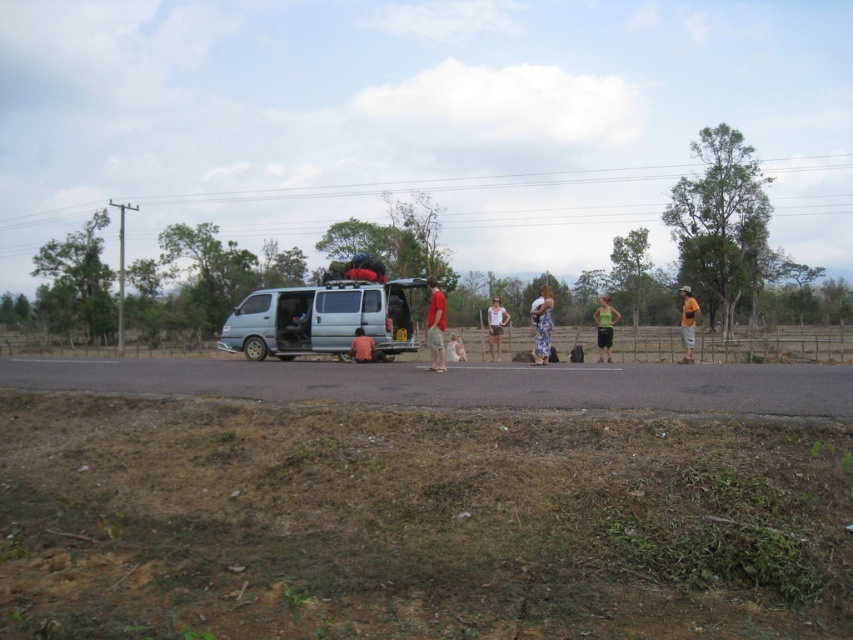
You are a photographer standing at the edge of the road. You want to take a photo of the floral dress at center and the pink fabric at center in the same frame. The camera you are using has a maximum focus range of 4 meters. Will both items be in focus?

The floral dress at center and pink fabric at center are 4.37 meters apart from each other. Since the camera can only focus up to 4 meters, the distance between them exceeds the focus range. Therefore, both items cannot be in focus simultaneously.

You are standing at the camera position and want to reach both point (544,310) and point (366,358). Which point should you reach first to minimize the distance walked?

Point (544,310) should be reached first since it is closer to the camera position compared to point (366,358).

You are a photographer trying to capture a group photo of the people near the van. You want to ensure both the red cotton shirt at center and orange fabric shorts at right are visible in the frame. Based on their positions, which side of the van should you position yourself to include both subjects?

The red cotton shirt at center is positioned on the left side of orange fabric shorts at right. To include both in the frame, you should position yourself to the left of the van so that the red cotton shirt at center and orange fabric shorts at right are both visible.